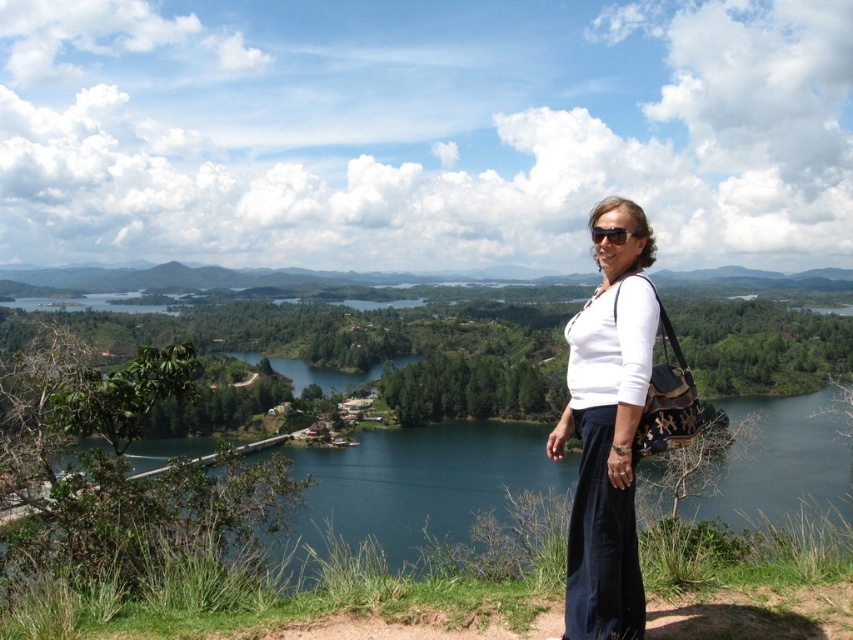
You are a photographer trying to capture a photo of the blue water at center and the white matte shirt at center in the same frame. Given that your camera has a maximum focus range of 60 meters, will both objects be in focus?

The blue water at center and the white matte shirt at center are 60.40 meters apart from each other. Since the distance exceeds the camera maximum focus range of 60 meters, both objects cannot be in focus simultaneously.